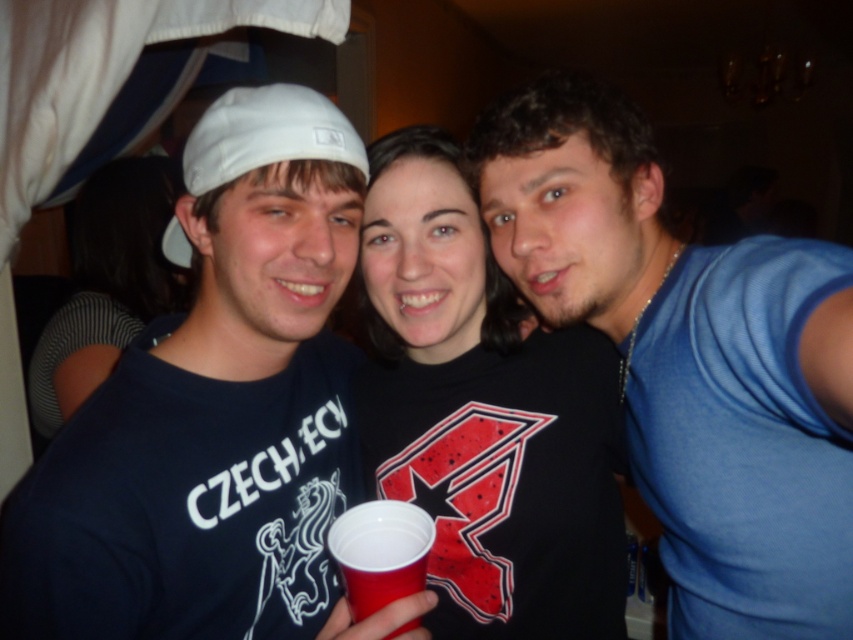
What is the color of the fabric at the point with coordinates (108, 284)?

The fabric at point (108, 284) is striped.

You are a photographer trying to adjust the focus of your camera to capture both the blue mesh tank top at right and the striped fabric shirt at center clearly. Which clothing item should you focus on first to ensure the shorter one is in focus?

The blue mesh tank top at right is shorter than the striped fabric shirt at center. To ensure the shorter one is in focus, you should focus on the blue mesh tank top at right first.

You are a photographer trying to adjust the focus on your camera. You want to ensure both the blue mesh tank top at right and the striped fabric shirt at center are in clear focus. Which clothing item should you focus on first to achieve this?

You should focus on the striped fabric shirt at center first because the blue mesh tank top at right is below it, meaning the striped fabric shirt is closer to the camera. By focusing on the closer object, the depth of field will naturally include the farther one.